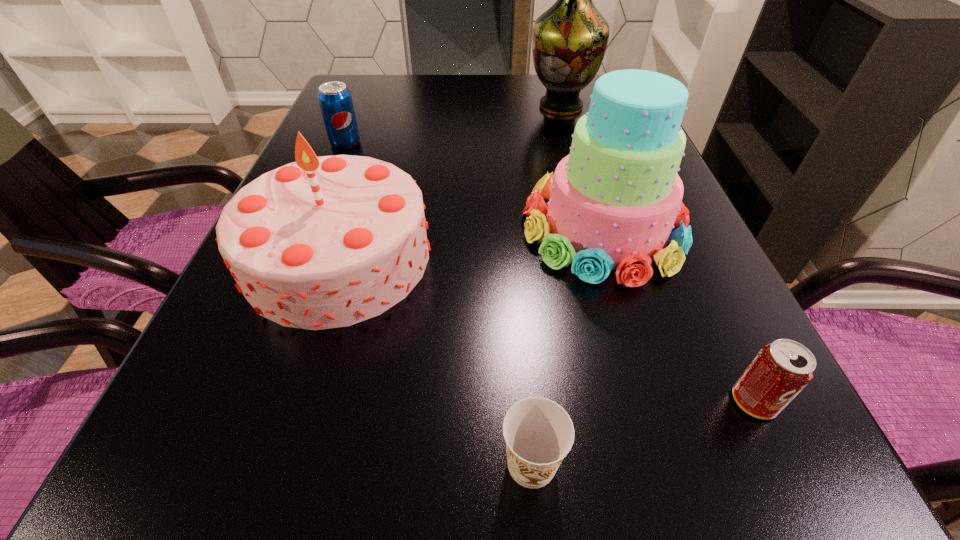
Identify the location of vase positioned at the right edge. (569, 40).

Identify the location of cake that is at the right edge. 614,200.

Identify the location of soda can that is at the right edge. This screenshot has height=540, width=960. (781, 370).

The image size is (960, 540). What are the coordinates of `object at the far right corner` in the screenshot? It's located at (569, 40).

Locate an element on the screen. free location at the far edge of the desktop is located at coordinates (429, 82).

Identify the location of free space at the near edge. The image size is (960, 540). (594, 500).

Where is `free space at the left edge`? This screenshot has width=960, height=540. free space at the left edge is located at coordinates 372,135.

Where is `free space at the right edge`? free space at the right edge is located at coordinates (666, 370).

Where is `free spot at the near left corner of the desktop`? This screenshot has height=540, width=960. free spot at the near left corner of the desktop is located at coordinates (164, 534).

Locate an element on the screen. free space between the cake and the birthday cake is located at coordinates (470, 242).